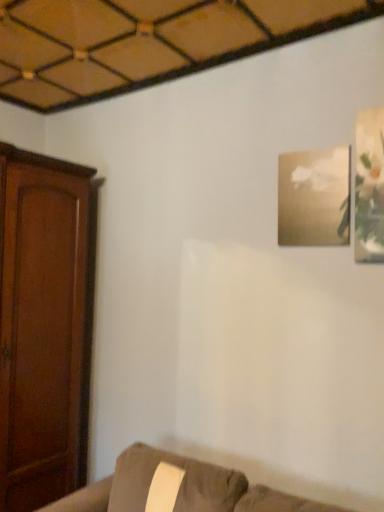
Question: Considering the relative positions of gold textured frame at upper right, the 1th picture frame positioned from the left, and matte white frame at upper right, positioned as the first picture frame in front-to-back order, in the image provided, is gold textured frame at upper right, the 1th picture frame positioned from the left, to the left or to the right of matte white frame at upper right, positioned as the first picture frame in front-to-back order,?

Choices:
 (A) left
 (B) right

Answer: (A)

Question: From a real-world perspective, relative to matte white frame at upper right, positioned as the first picture frame in front-to-back order, is gold textured frame at upper right, positioned as the second picture frame in front-to-back order, vertically above or below?

Choices:
 (A) above
 (B) below

Answer: (B)

Question: Which is nearer to the matte white frame at upper right, which ranks as the 2th picture frame in left-to-right order?

Choices:
 (A) suede couch at lower right
 (B) gold textured frame at upper right, placed as the first picture frame when sorted from back to front

Answer: (B)

Question: Which is nearer to the suede couch at lower right?

Choices:
 (A) matte white frame at upper right, which ranks as the 2th picture frame in left-to-right order
 (B) gold textured frame at upper right, the second picture frame in the right-to-left sequence

Answer: (B)